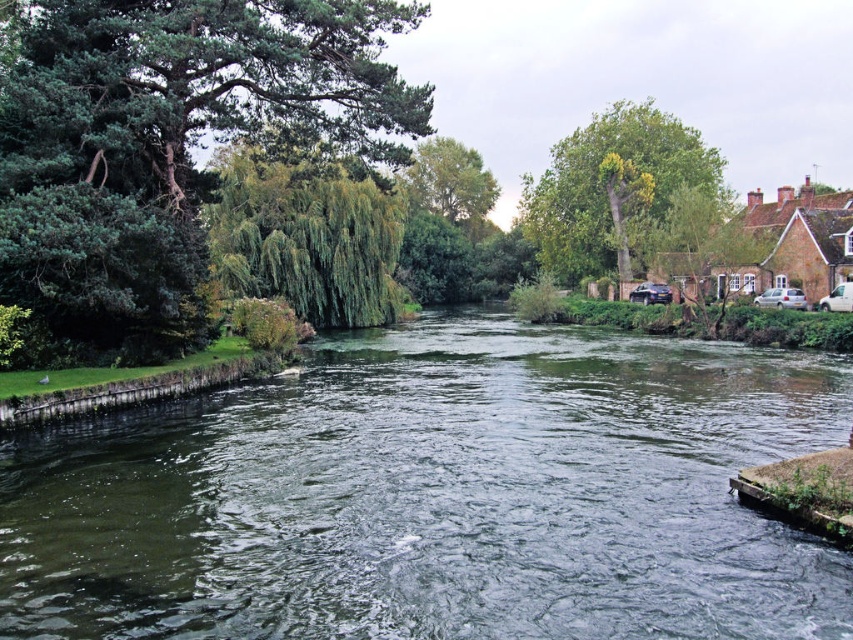
Is point (521, 204) behind point (477, 172)?

That is False.

Does green leafy tree at upper right have a greater width compared to green leafy tree at upper center?

Yes.

What do you see at coordinates (613, 189) in the screenshot? The width and height of the screenshot is (853, 640). I see `green leafy tree at upper right` at bounding box center [613, 189].

Where is `green leafy tree at upper right`? green leafy tree at upper right is located at coordinates (613, 189).

Is the position of green water at center less distant than that of green leafy tree at upper center?

Yes, it is in front of green leafy tree at upper center.

Is point (450, 333) farther from camera compared to point (469, 172)?

No, it is in front of (469, 172).

Find the location of a particular element. The height and width of the screenshot is (640, 853). green water at center is located at coordinates (436, 496).

Is green needle-like leaves at left further to the viewer compared to green leafy tree at upper center?

No, green needle-like leaves at left is in front of green leafy tree at upper center.

You are a GUI agent. You are given a task and a screenshot of the screen. Output one action in this format:
    pyautogui.click(x=<x>, y=<y>)
    Task: Click on the green needle-like leaves at left
    The width and height of the screenshot is (853, 640).
    Given the screenshot: What is the action you would take?
    pyautogui.click(x=166, y=141)